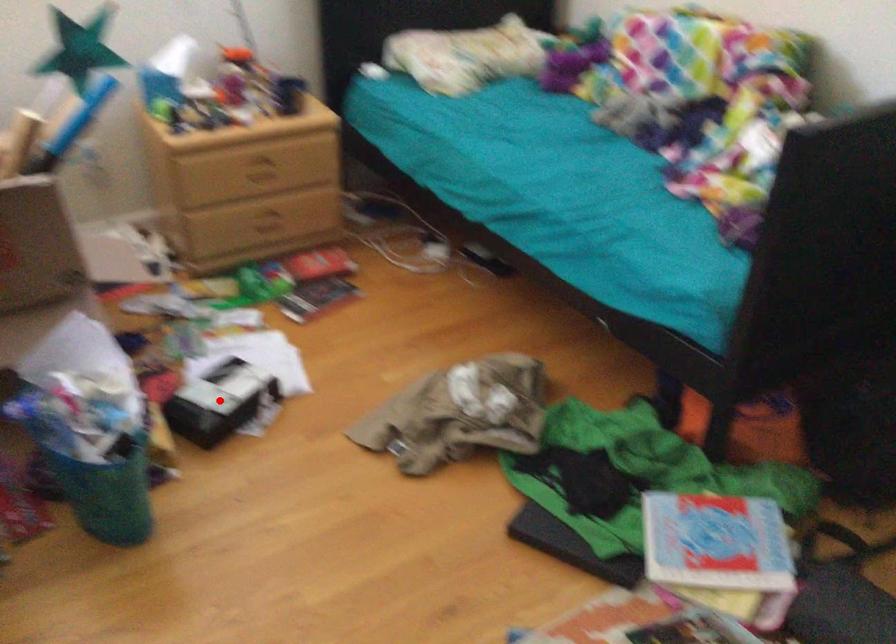
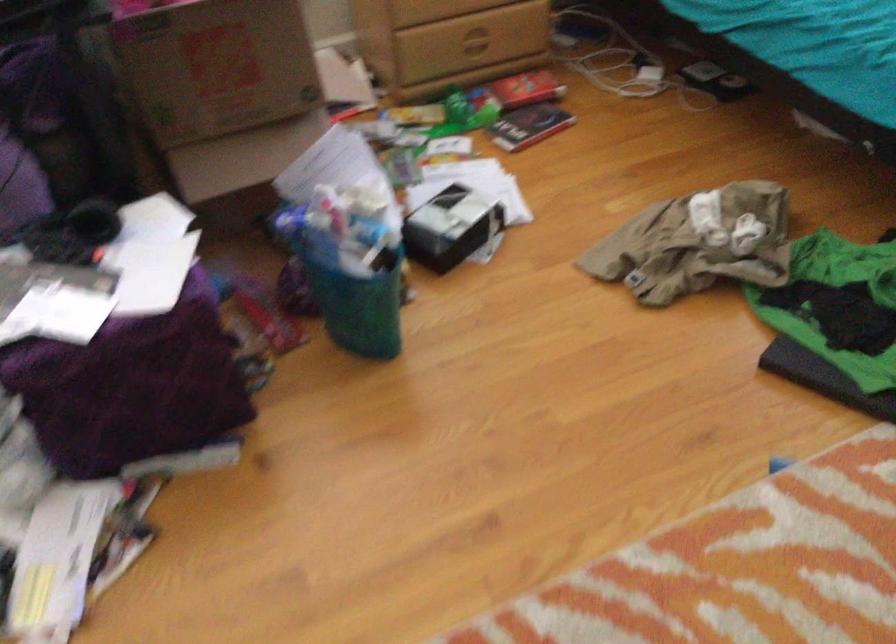
The point at the highlighted location is marked in the first image. Where is the corresponding point in the second image?

(451, 227)